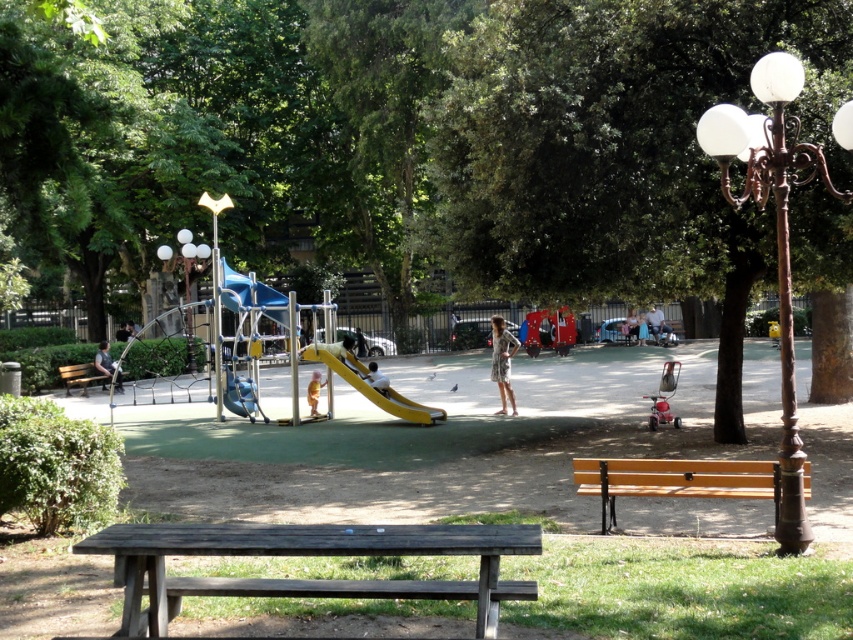
You are a photographer trying to capture a candid shot of the light blue denim dress at center without including the dark gray fabric jacket at left in the frame. Is this possible given their positions?

The dark gray fabric jacket at left is in front of the light blue denim dress at center, so it would block the view. Therefore, capturing the light blue denim dress at center without the jacket would not be possible unless you move to a different angle.

Consider the image. You are planning to install a new swing set in the park. The swing set requires a minimum space of 2 meters between the slide and the jeans. Based on the image, can the swing set be placed between the light brown wooden slide at center and the light blue denim jeans at center?

The light brown wooden slide at center is narrower than the light blue denim jeans at center. However, the Objects Description only provides information about their widths, not the distance between them. Therefore, it is impossible to determine if the required 2 meters of space exists between them based on the given information.